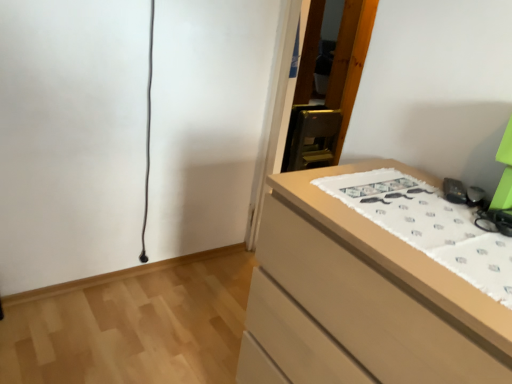
Question: Can you confirm if white fabric with printed mustaches at right is thinner than matte wood chest of drawers at lower right?

Choices:
 (A) yes
 (B) no

Answer: (A)

Question: Is white fabric with printed mustaches at right bigger than matte wood chest of drawers at lower right?

Choices:
 (A) yes
 (B) no

Answer: (B)

Question: Is matte wood chest of drawers at lower right at the back of white fabric with printed mustaches at right?

Choices:
 (A) no
 (B) yes

Answer: (B)

Question: Is white fabric with printed mustaches at right to the left of matte wood chest of drawers at lower right from the viewer's perspective?

Choices:
 (A) no
 (B) yes

Answer: (A)

Question: Does white fabric with printed mustaches at right appear on the right side of matte wood chest of drawers at lower right?

Choices:
 (A) no
 (B) yes

Answer: (B)

Question: From the image's perspective, is white fabric with printed mustaches at right located beneath matte wood chest of drawers at lower right?

Choices:
 (A) no
 (B) yes

Answer: (A)

Question: Is matte wood chest of drawers at lower right at the right side of white fabric with printed mustaches at right?

Choices:
 (A) yes
 (B) no

Answer: (B)

Question: Would you say white fabric with printed mustaches at right is part of matte wood chest of drawers at lower right's contents?

Choices:
 (A) no
 (B) yes

Answer: (B)

Question: From a real-world perspective, is matte wood chest of drawers at lower right below white fabric with printed mustaches at right?

Choices:
 (A) yes
 (B) no

Answer: (A)

Question: Can you confirm if matte wood chest of drawers at lower right is taller than white fabric with printed mustaches at right?

Choices:
 (A) no
 (B) yes

Answer: (B)

Question: Is matte wood chest of drawers at lower right in contact with white fabric with printed mustaches at right?

Choices:
 (A) no
 (B) yes

Answer: (A)

Question: Does matte wood chest of drawers at lower right have a lesser width compared to white fabric with printed mustaches at right?

Choices:
 (A) no
 (B) yes

Answer: (A)

Question: Do you think matte wood chest of drawers at lower right is within white fabric with printed mustaches at right, or outside of it?

Choices:
 (A) outside
 (B) inside

Answer: (A)